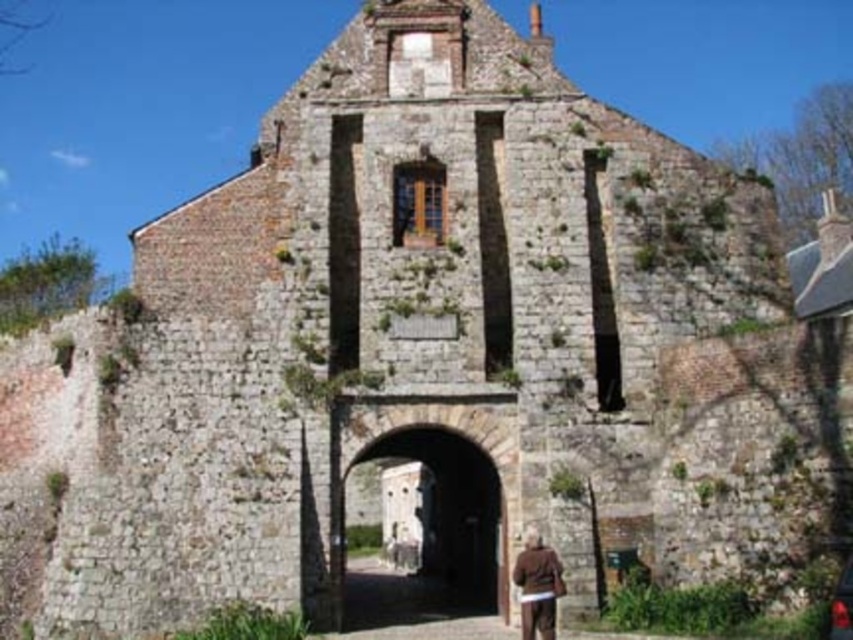
Is stone archway at center positioned behind shiny black car at lower right?

Yes, stone archway at center is behind shiny black car at lower right.

How much distance is there between stone archway at center and shiny black car at lower right?

The distance of stone archway at center from shiny black car at lower right is 71.73 feet.

Between point (403, 406) and point (845, 634), which one is positioned in front?

Point (845, 634)

Locate an element on the screen. The height and width of the screenshot is (640, 853). stone archway at center is located at coordinates (462, 436).

Is stone archway at center smaller than brown leather jacket at lower center?

No.

Can you confirm if stone archway at center is positioned above brown leather jacket at lower center?

Yes, stone archway at center is above brown leather jacket at lower center.

Is point (370, 416) positioned before point (526, 614)?

No, it is behind (526, 614).

At what (x,y) coordinates should I click in order to perform the action: click on stone archway at center. Please return your answer as a coordinate pair (x, y). This screenshot has height=640, width=853. Looking at the image, I should click on (462, 436).

Measure the distance between brown leather jacket at lower center and camera.

brown leather jacket at lower center is 50.40 meters from camera.

Is brown leather jacket at lower center to the right of shiny black car at lower right from the viewer's perspective?

No, brown leather jacket at lower center is not to the right of shiny black car at lower right.

In the scene shown: Who is more distant from viewer, [532,600] or [830,618]?

The point [532,600] is more distant.

Where is `brown leather jacket at lower center`? The height and width of the screenshot is (640, 853). brown leather jacket at lower center is located at coordinates (537, 586).